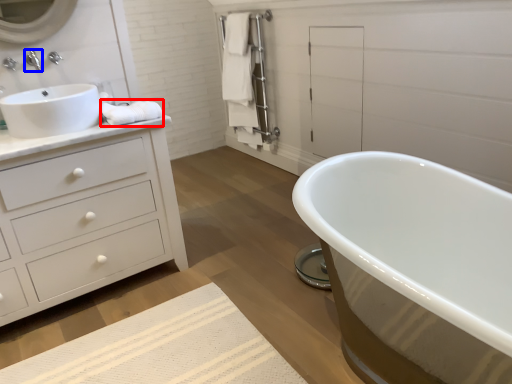
Question: Which point is closer to the camera, material (highlighted by a red box) or tap (highlighted by a blue box)?

Choices:
 (A) material
 (B) tap

Answer: (A)